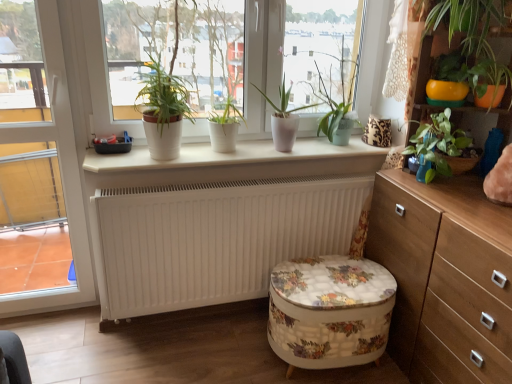
You are a GUI agent. You are given a task and a screenshot of the screen. Output one action in this format:
    pyautogui.click(x=<x>, y=<y>)
    Task: Click on the free area in between white matte pot at center, acting as the 4th houseplant starting from the right, and matte white pot at upper left, the first houseplant viewed from the left
    The width and height of the screenshot is (512, 384).
    Given the screenshot: What is the action you would take?
    pyautogui.click(x=220, y=158)